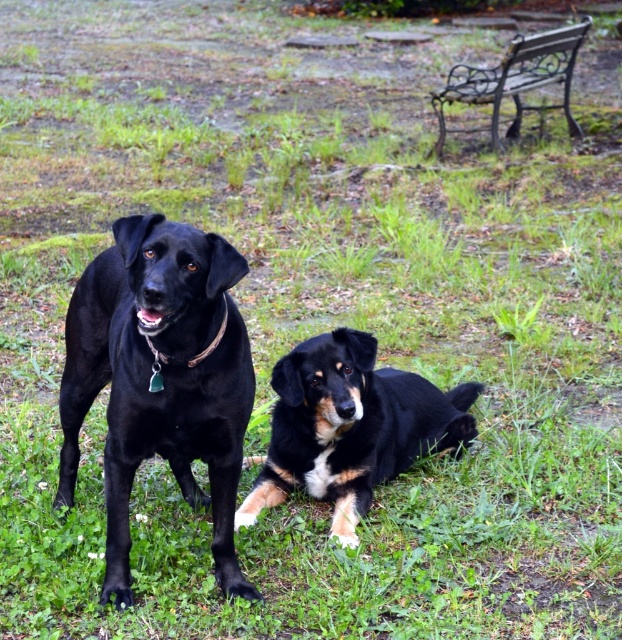
Can you confirm if matte black dog at left is positioned above black fur dog at center?

Indeed, matte black dog at left is positioned over black fur dog at center.

Is point (180, 323) in front of point (318, 403)?

Yes, it is in front of point (318, 403).

What do you see at coordinates (159, 378) in the screenshot? I see `matte black dog at left` at bounding box center [159, 378].

I want to click on matte black dog at left, so click(159, 378).

Which of these two, matte black dog at left or metallic wrought iron bench at upper right, stands shorter?

With less height is matte black dog at left.

Locate an element on the screen. The height and width of the screenshot is (640, 622). matte black dog at left is located at coordinates (159, 378).

Find the location of a particular element. The image size is (622, 640). matte black dog at left is located at coordinates [x=159, y=378].

Between point (343, 352) and point (585, 28), which one is positioned behind?

The point (585, 28) is more distant.

Is black fur dog at center to the right of metallic wrought iron bench at upper right from the viewer's perspective?

No, black fur dog at center is not to the right of metallic wrought iron bench at upper right.

Who is more forward, (392,372) or (521,60)?

Point (392,372)

At what (x,y) coordinates should I click in order to perform the action: click on black fur dog at center. Please return your answer as a coordinate pair (x, y). Looking at the image, I should click on (350, 426).